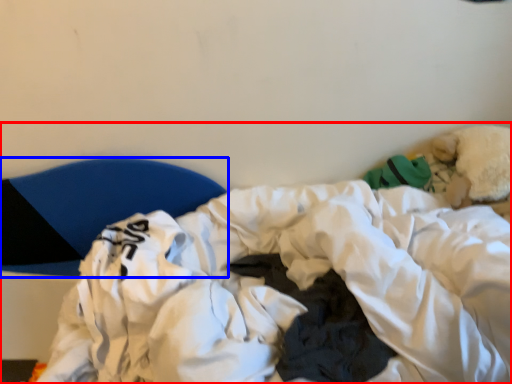
Question: Among these objects, which one is nearest to the camera, hospital bed (highlighted by a red box) or furniture (highlighted by a blue box)?

Choices:
 (A) hospital bed
 (B) furniture

Answer: (A)